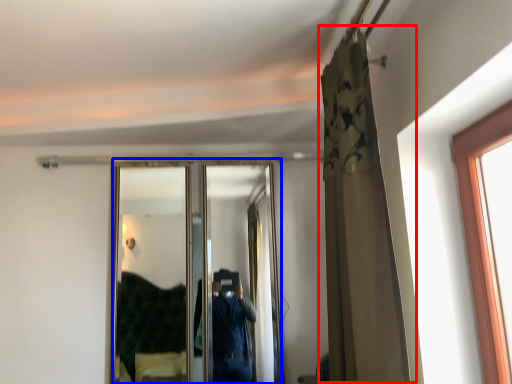
Question: Which object is further to the camera taking this photo, curtain (highlighted by a red box) or mirror (highlighted by a blue box)?

Choices:
 (A) curtain
 (B) mirror

Answer: (B)